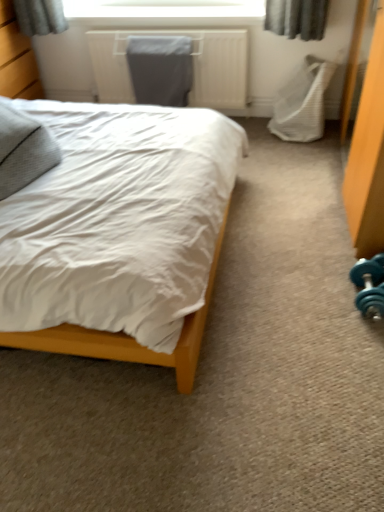
Question: From the image's perspective, is white matte bed at center on top of wooden dresser at left?

Choices:
 (A) no
 (B) yes

Answer: (A)

Question: From a real-world perspective, is white matte bed at center on top of wooden dresser at left?

Choices:
 (A) no
 (B) yes

Answer: (A)

Question: From a real-world perspective, is white matte bed at center below wooden dresser at left?

Choices:
 (A) yes
 (B) no

Answer: (A)

Question: Is there a large distance between white matte bed at center and wooden dresser at left?

Choices:
 (A) yes
 (B) no

Answer: (A)

Question: Is white matte bed at center oriented away from wooden dresser at left?

Choices:
 (A) yes
 (B) no

Answer: (B)

Question: Considering their positions, is teal rubber dumbbell at lower right located in front of or behind wooden dresser at left?

Choices:
 (A) front
 (B) behind

Answer: (A)

Question: From the image's perspective, is teal rubber dumbbell at lower right positioned above or below wooden dresser at left?

Choices:
 (A) above
 (B) below

Answer: (B)

Question: Considering the positions of teal rubber dumbbell at lower right and wooden dresser at left in the image, is teal rubber dumbbell at lower right wider or thinner than wooden dresser at left?

Choices:
 (A) wide
 (B) thin

Answer: (B)

Question: Considering the positions of point (382, 305) and point (6, 57), is point (382, 305) closer or farther from the camera than point (6, 57)?

Choices:
 (A) farther
 (B) closer

Answer: (B)

Question: Is teal rubber dumbbell at lower right to the left or to the right of white fabric swivel chair at right in the image?

Choices:
 (A) right
 (B) left

Answer: (A)

Question: Considering the positions of teal rubber dumbbell at lower right and white fabric swivel chair at right in the image, is teal rubber dumbbell at lower right taller or shorter than white fabric swivel chair at right?

Choices:
 (A) tall
 (B) short

Answer: (B)

Question: From the image's perspective, relative to white fabric swivel chair at right, is teal rubber dumbbell at lower right above or below?

Choices:
 (A) below
 (B) above

Answer: (A)

Question: Considering their positions, is teal rubber dumbbell at lower right located in front of or behind white fabric swivel chair at right?

Choices:
 (A) behind
 (B) front

Answer: (B)

Question: Relative to teal rubber dumbbell at lower right, is wooden dresser at left in front or behind?

Choices:
 (A) front
 (B) behind

Answer: (B)

Question: Is wooden dresser at left bigger or smaller than teal rubber dumbbell at lower right?

Choices:
 (A) small
 (B) big

Answer: (B)